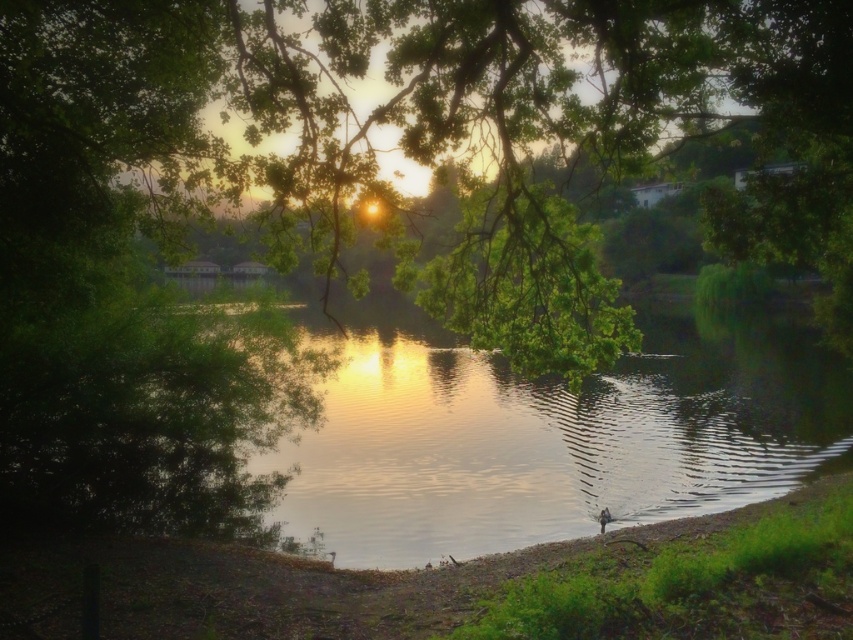
At what (x,y) coordinates should I click in order to perform the action: click on green reflective water at center. Please return your answer as a coordinate pair (x, y). Looking at the image, I should click on (535, 433).

Does green reflective water at center have a greater width compared to dull brown dirt at lower center?

Correct, the width of green reflective water at center exceeds that of dull brown dirt at lower center.

The height and width of the screenshot is (640, 853). I want to click on green reflective water at center, so click(x=535, y=433).